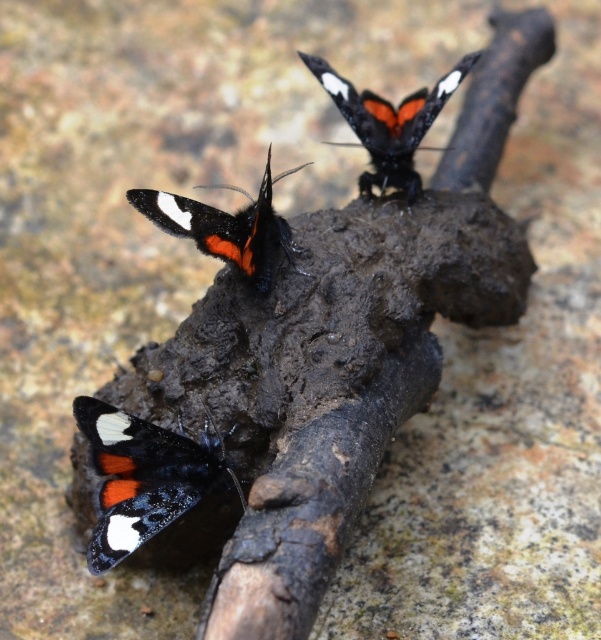
You are an entomologist observing the butterflies. You notice two butterflies on the bark. Which one is smaller between the black glossy butterfly at center and the matte black butterfly at upper center?

The black glossy butterfly at center is smaller than the matte black butterfly at upper center.

You are a photographer aiming to capture a closeup of the matte black butterfly at lower left and the black glossy butterfly at center. Since you want both butterflies to be in focus, which one should you focus on first to ensure the other is also sharp?

You should focus on the matte black butterfly at lower left first because it is closer to the viewer than the black glossy butterfly at center. By focusing on the closer butterfly, the farther one will also be in focus due to the depth of field.

You are an entomologist observing two butterflies in a forest. You have a net that can only catch butterflies with a width of 5 cm or less. The matte black butterfly at lower left and the black glossy butterfly at center are both in your sight. Based on their sizes, can you safely assume that both will fit into your net?

The matte black butterfly at lower left is thinner than the black glossy butterfly at center. Since the net can only catch butterflies with a width of 5 cm or less, you need to check both butterflies. However, the description only mentions the relative thinness between them, not their exact widths. Without knowing their actual sizes, you cannot safely assume both will fit into the net.